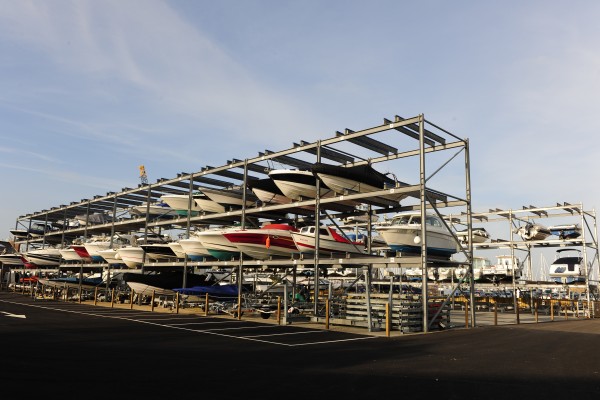
Where is `rack`? rack is located at coordinates (452, 200), (430, 123), (421, 302), (542, 219).